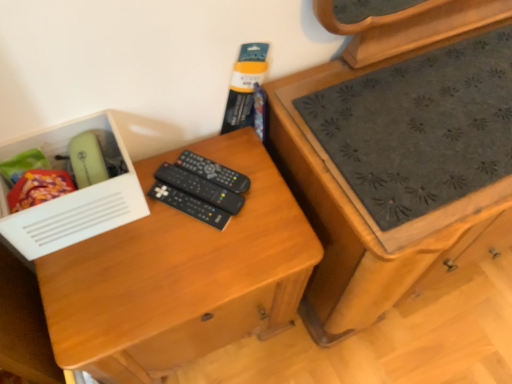
Image resolution: width=512 pixels, height=384 pixels. Identify the location of vacant area that lies between white plastic box at left and black plastic remote controls at center, acting as the 3th remote control starting from the top. (143, 232).